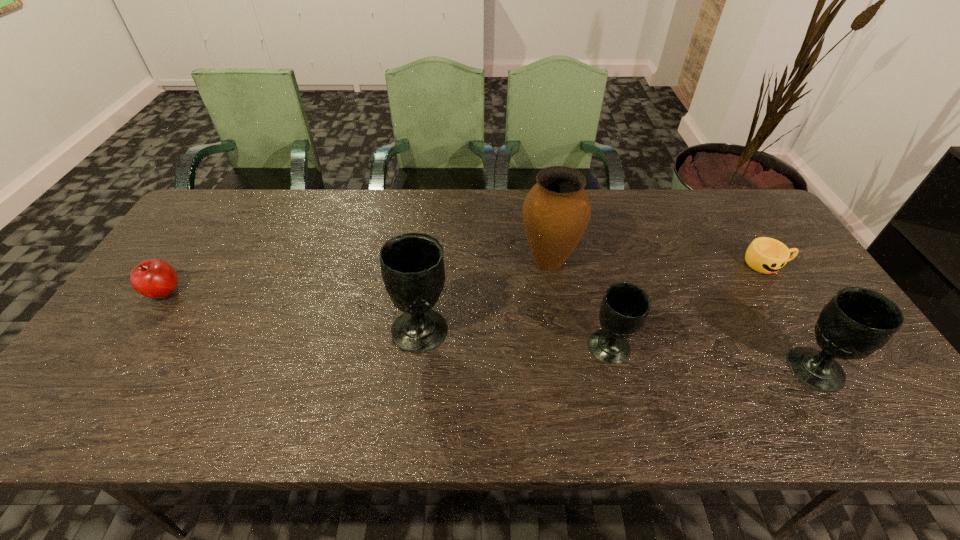
In order to click on vacant area located 0.060m on the right of the shortest chalice in this screenshot , I will do `click(656, 348)`.

At what (x,y) coordinates should I click in order to perform the action: click on free spot located on the left of the rightmost chalice. Please return your answer as a coordinate pair (x, y). Looking at the image, I should click on (727, 369).

Where is `vacant position located on the front of the cup`? The image size is (960, 540). vacant position located on the front of the cup is located at coordinates (793, 303).

What are the coordinates of `vacant space positioned on the back of the urn` in the screenshot? It's located at (541, 215).

At what (x,y) coordinates should I click in order to perform the action: click on free space located on the right of the second shortest object. Please return your answer as a coordinate pair (x, y). This screenshot has width=960, height=540. Looking at the image, I should click on tap(201, 291).

You are a GUI agent. You are given a task and a screenshot of the screen. Output one action in this format:
    pyautogui.click(x=<x>, y=<y>)
    Task: Click on the object present at the left edge
    The width and height of the screenshot is (960, 540).
    Given the screenshot: What is the action you would take?
    pyautogui.click(x=154, y=278)

Where is `chalice located at the right edge`? This screenshot has width=960, height=540. chalice located at the right edge is located at coordinates (856, 322).

Where is `cup that is positioned at the right edge`? cup that is positioned at the right edge is located at coordinates (766, 255).

Locate an element on the screen. The height and width of the screenshot is (540, 960). object that is at the near right corner is located at coordinates (856, 322).

Image resolution: width=960 pixels, height=540 pixels. What are the coordinates of `free spot at the far edge of the desktop` in the screenshot? It's located at (266, 206).